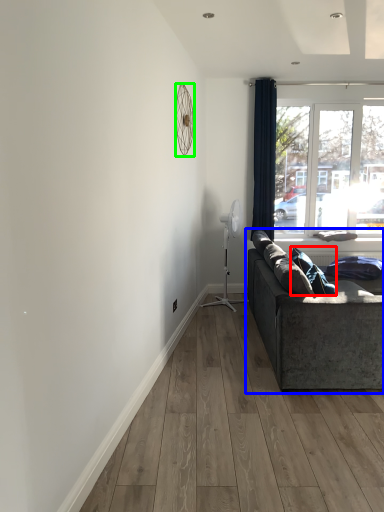
Question: Estimate the real-world distances between objects in this image. Which object is closer to pillow (highlighted by a red box), studio couch (highlighted by a blue box) or mechanical fan (highlighted by a green box)?

Choices:
 (A) studio couch
 (B) mechanical fan

Answer: (A)